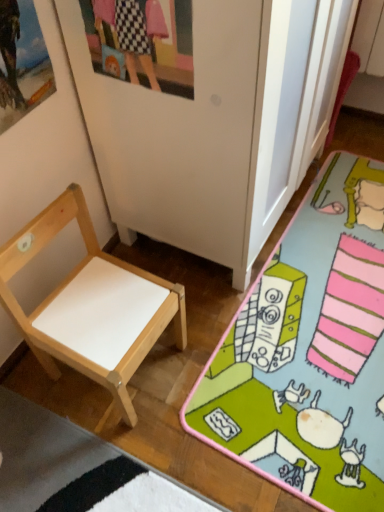
This screenshot has height=512, width=384. I want to click on wooden picture frame at upper left, which ranks as the 1th picture frame in left-to-right order, so click(22, 62).

Image resolution: width=384 pixels, height=512 pixels. Describe the element at coordinates (22, 62) in the screenshot. I see `wooden picture frame at upper left, the 2th picture frame from the right` at that location.

The height and width of the screenshot is (512, 384). Identify the location of wooden picture frame at upper left, the 2th picture frame from the right. (22, 62).

Which of these two, matte plastic picture frame at upper center, which is the 2th picture frame in left-to-right order, or natural wood chair at left, is bigger?

natural wood chair at left is bigger.

Is matte plastic picture frame at upper center, which is the 2th picture frame in left-to-right order, positioned far away from natural wood chair at left?

That's not correct — matte plastic picture frame at upper center, which is the 2th picture frame in left-to-right order, is a little close to natural wood chair at left.

Looking at this image, is matte plastic picture frame at upper center, which is the 2th picture frame in left-to-right order, situated inside natural wood chair at left or outside?

Answer: matte plastic picture frame at upper center, which is the 2th picture frame in left-to-right order, lies outside natural wood chair at left.

From the image's perspective, does matte plastic picture frame at upper center, which is the 2th picture frame in left-to-right order, appear lower than natural wood chair at left?

No.

Considering their positions, is white matte desk at lower left located in front of or behind natural wood chair at left?

white matte desk at lower left is positioned farther from the viewer than natural wood chair at left.

From the image's perspective, is white matte desk at lower left positioned above or below natural wood chair at left?

From the image's perspective, white matte desk at lower left appears above natural wood chair at left.

Can you tell me how much white matte desk at lower left and natural wood chair at left differ in facing direction?

white matte desk at lower left and natural wood chair at left are facing 90.8 degrees away from each other.

Looking at this image, is natural wood chair at left surrounded by white matte desk at lower left?

No, natural wood chair at left is not inside white matte desk at lower left.

Consider the image. Is matte plastic picture frame at upper center, the 1th picture frame from the right, inside white matte desk at lower left?

No, matte plastic picture frame at upper center, the 1th picture frame from the right, is not surrounded by white matte desk at lower left.

Is the depth of white matte desk at lower left greater than that of matte plastic picture frame at upper center, which is the 2th picture frame in left-to-right order?

Yes, white matte desk at lower left is further from the camera.

Who is taller, white matte desk at lower left or matte plastic picture frame at upper center, the 1th picture frame from the right?

matte plastic picture frame at upper center, the 1th picture frame from the right.

Which is more to the left, matte plastic picture frame at upper center, which is the 2th picture frame in left-to-right order, or wooden picture frame at upper left, which ranks as the 1th picture frame in left-to-right order?

wooden picture frame at upper left, which ranks as the 1th picture frame in left-to-right order, is more to the left.

From a real-world perspective, does matte plastic picture frame at upper center, which is the 2th picture frame in left-to-right order, sit lower than wooden picture frame at upper left, the 2th picture frame from the right?

No, from a real-world perspective, matte plastic picture frame at upper center, which is the 2th picture frame in left-to-right order, is not under wooden picture frame at upper left, the 2th picture frame from the right.

The width and height of the screenshot is (384, 512). In order to click on picture frame lying behind the wooden picture frame at upper left, which ranks as the 1th picture frame in left-to-right order in this screenshot , I will do `click(142, 42)`.

Are natural wood chair at left and white matte desk at lower left beside each other?

No, natural wood chair at left is not next to white matte desk at lower left.

From a real-world perspective, does natural wood chair at left stand above white matte desk at lower left?

Yes, from a real-world perspective, natural wood chair at left is over white matte desk at lower left

From the image's perspective, between natural wood chair at left and white matte desk at lower left, which one is located above?

white matte desk at lower left appears higher in the image.

In the scene shown: Does natural wood chair at left have a greater height compared to white matte desk at lower left?

Yes, natural wood chair at left is taller than white matte desk at lower left.

Considering the positions of objects natural wood chair at left and matte plastic picture frame at upper center, which is the 2th picture frame in left-to-right order, in the image provided, who is more to the right, natural wood chair at left or matte plastic picture frame at upper center, which is the 2th picture frame in left-to-right order,?

matte plastic picture frame at upper center, which is the 2th picture frame in left-to-right order, is more to the right.

Which picture frame is the 1st one when counting from the front of the natural wood chair at left? Please provide its 2D coordinates.

[(142, 42)]

Considering the relative sizes of natural wood chair at left and matte plastic picture frame at upper center, which is the 2th picture frame in left-to-right order, in the image provided, is natural wood chair at left shorter than matte plastic picture frame at upper center, which is the 2th picture frame in left-to-right order,?

In fact, natural wood chair at left may be taller than matte plastic picture frame at upper center, which is the 2th picture frame in left-to-right order.

From the image's perspective, does natural wood chair at left appear lower than wooden picture frame at upper left, the 2th picture frame from the right?

Indeed, from the image's perspective, natural wood chair at left is shown beneath wooden picture frame at upper left, the 2th picture frame from the right.

Which of these two, natural wood chair at left or wooden picture frame at upper left, which ranks as the 1th picture frame in left-to-right order, is smaller?

wooden picture frame at upper left, which ranks as the 1th picture frame in left-to-right order.

Is natural wood chair at left inside or outside of wooden picture frame at upper left, which ranks as the 1th picture frame in left-to-right order?

natural wood chair at left is spatially situated outside wooden picture frame at upper left, which ranks as the 1th picture frame in left-to-right order.

From a real-world perspective, between natural wood chair at left and wooden picture frame at upper left, the 2th picture frame from the right, who is vertically higher?

wooden picture frame at upper left, the 2th picture frame from the right.

Identify the location of chair that appears below the matte plastic picture frame at upper center, which is the 2th picture frame in left-to-right order (from the image's perspective). (91, 305).

Locate an element on the screen. The width and height of the screenshot is (384, 512). desk behind the natural wood chair at left is located at coordinates (309, 351).

When comparing their distances from natural wood chair at left, does wooden picture frame at upper left, the 2th picture frame from the right, or white matte desk at lower left seem closer?

white matte desk at lower left lies closer to natural wood chair at left than the other object.

When comparing their distances from white matte desk at lower left, does wooden picture frame at upper left, which ranks as the 1th picture frame in left-to-right order, or natural wood chair at left seem further?

wooden picture frame at upper left, which ranks as the 1th picture frame in left-to-right order, lies further to white matte desk at lower left than the other object.

Based on the photo, which object lies further to the anchor point natural wood chair at left, white matte desk at lower left or matte plastic picture frame at upper center, the 1th picture frame from the right?

The object further to natural wood chair at left is matte plastic picture frame at upper center, the 1th picture frame from the right.

Consider the image. Based on their spatial positions, is white matte desk at lower left or wooden picture frame at upper left, which ranks as the 1th picture frame in left-to-right order, closer to natural wood chair at left?

white matte desk at lower left is positioned closer to the anchor natural wood chair at left.

Based on the photo, which object lies nearer to the anchor point white matte desk at lower left, wooden picture frame at upper left, the 2th picture frame from the right, or matte plastic picture frame at upper center, which is the 2th picture frame in left-to-right order?

Among the two, matte plastic picture frame at upper center, which is the 2th picture frame in left-to-right order, is located nearer to white matte desk at lower left.

Consider the image. Which object lies further to the anchor point matte plastic picture frame at upper center, the 1th picture frame from the right, white matte desk at lower left or wooden picture frame at upper left, which ranks as the 1th picture frame in left-to-right order?

Based on the image, white matte desk at lower left appears to be further to matte plastic picture frame at upper center, the 1th picture frame from the right.

From the image, which object appears to be nearer to matte plastic picture frame at upper center, which is the 2th picture frame in left-to-right order, wooden picture frame at upper left, the 2th picture frame from the right, or white matte desk at lower left?

wooden picture frame at upper left, the 2th picture frame from the right.

Considering their positions, is white matte desk at lower left positioned closer to wooden picture frame at upper left, which ranks as the 1th picture frame in left-to-right order, than matte plastic picture frame at upper center, which is the 2th picture frame in left-to-right order?

Based on the image, matte plastic picture frame at upper center, which is the 2th picture frame in left-to-right order, appears to be nearer to wooden picture frame at upper left, which ranks as the 1th picture frame in left-to-right order.

The width and height of the screenshot is (384, 512). Identify the location of picture frame located between natural wood chair at left and white matte desk at lower left in the left-right direction. (142, 42).

You are a GUI agent. You are given a task and a screenshot of the screen. Output one action in this format:
    pyautogui.click(x=<x>, y=<y>)
    Task: Click on the picture frame between matte plastic picture frame at upper center, the 1th picture frame from the right, and natural wood chair at left from top to bottom
    
    Given the screenshot: What is the action you would take?
    pyautogui.click(x=22, y=62)

This screenshot has width=384, height=512. I want to click on chair located between wooden picture frame at upper left, the 2th picture frame from the right, and white matte desk at lower left in the left-right direction, so click(x=91, y=305).

This screenshot has height=512, width=384. I want to click on picture frame situated between wooden picture frame at upper left, which ranks as the 1th picture frame in left-to-right order, and white matte desk at lower left from left to right, so click(142, 42).